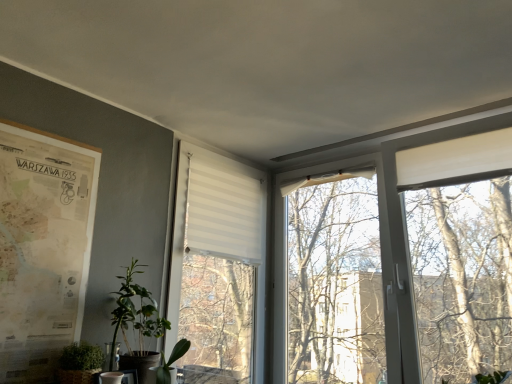
This screenshot has width=512, height=384. I want to click on white striped fabric at center, so click(213, 219).

The width and height of the screenshot is (512, 384). What do you see at coordinates (213, 219) in the screenshot?
I see `white striped fabric at center` at bounding box center [213, 219].

Image resolution: width=512 pixels, height=384 pixels. Describe the element at coordinates (138, 322) in the screenshot. I see `green matte plant at lower left, placed as the 2th houseplant when sorted from right to left` at that location.

Find the location of `green matte plant at lower left, placed as the second houseplant when sorted from left to right`. green matte plant at lower left, placed as the second houseplant when sorted from left to right is located at coordinates (138, 322).

Identify the location of beige paper map at left. Image resolution: width=512 pixels, height=384 pixels. (42, 248).

The height and width of the screenshot is (384, 512). Identify the location of white striped fabric at center. (213, 219).

Does point (170, 338) appear closer or farther from the camera than point (91, 350)?

Point (170, 338) is farther from the camera than point (91, 350).

Based on the photo, could you tell me if white striped fabric at center is facing green matte plant at lower left, the 3th houseplant when ordered from right to left?

No, white striped fabric at center is not facing towards green matte plant at lower left, the 3th houseplant when ordered from right to left.

Which is correct: white striped fabric at center is inside green matte plant at lower left, arranged as the first houseplant when viewed from the left, or outside of it?

white striped fabric at center is located beyond the bounds of green matte plant at lower left, arranged as the first houseplant when viewed from the left.

Where is `the 2nd houseplant below when counting from the white striped fabric at center (from the image's perspective)`? This screenshot has width=512, height=384. the 2nd houseplant below when counting from the white striped fabric at center (from the image's perspective) is located at coordinates (80, 364).

Between beige paper map at left and white striped fabric at center, which one has larger size?

With larger size is white striped fabric at center.

Which of these two, beige paper map at left or white striped fabric at center, is wider?

With larger width is white striped fabric at center.

Is point (60, 277) positioned in front of point (191, 167)?

Yes, it is in front of point (191, 167).

Is beige paper map at left located outside white striped fabric at center?

Indeed, beige paper map at left is completely outside white striped fabric at center.

Looking at this image, which object is further away from the camera, beige paper map at left or green matte plant at lower center, acting as the 3th houseplant starting from the left?

green matte plant at lower center, acting as the 3th houseplant starting from the left, is further from the camera.

Can you confirm if beige paper map at left is positioned to the right of green matte plant at lower center, acting as the 3th houseplant starting from the left?

In fact, beige paper map at left is to the left of green matte plant at lower center, acting as the 3th houseplant starting from the left.

From a real-world perspective, which is physically below, beige paper map at left or green matte plant at lower center, acting as the 3th houseplant starting from the left?

From a 3D spatial view, green matte plant at lower center, acting as the 3th houseplant starting from the left, is below.

Considering the points (4, 250) and (176, 344), which point is behind, point (4, 250) or point (176, 344)?

The point (176, 344) is farther from the camera.

Considering the positions of objects white striped fabric at center and green matte plant at lower center, acting as the 3th houseplant starting from the left, in the image provided, who is behind, white striped fabric at center or green matte plant at lower center, acting as the 3th houseplant starting from the left,?

white striped fabric at center is more distant.

In terms of height, does white striped fabric at center look taller or shorter compared to green matte plant at lower center, which is the first houseplant in right-to-left order?

Considering their sizes, white striped fabric at center has more height than green matte plant at lower center, which is the first houseplant in right-to-left order.

Looking at their sizes, would you say white striped fabric at center is wider or thinner than green matte plant at lower center, acting as the 3th houseplant starting from the left?

In the image, white striped fabric at center appears to be more narrow than green matte plant at lower center, acting as the 3th houseplant starting from the left.

Can you confirm if white striped fabric at center is bigger than green matte plant at lower center, acting as the 3th houseplant starting from the left?

Yes, white striped fabric at center is bigger than green matte plant at lower center, acting as the 3th houseplant starting from the left.

Is green matte plant at lower center, which is the first houseplant in right-to-left order, far from green matte plant at lower left, arranged as the first houseplant when viewed from the left?

green matte plant at lower center, which is the first houseplant in right-to-left order, is actually quite close to green matte plant at lower left, arranged as the first houseplant when viewed from the left.

From the image's perspective, would you say green matte plant at lower center, acting as the 3th houseplant starting from the left, is positioned over green matte plant at lower left, the 3th houseplant when ordered from right to left?

No, from the image's perspective, green matte plant at lower center, acting as the 3th houseplant starting from the left, is not on top of green matte plant at lower left, the 3th houseplant when ordered from right to left.

Considering the sizes of objects green matte plant at lower center, which is the first houseplant in right-to-left order, and green matte plant at lower left, the 3th houseplant when ordered from right to left, in the image provided, who is thinner, green matte plant at lower center, which is the first houseplant in right-to-left order, or green matte plant at lower left, the 3th houseplant when ordered from right to left,?

green matte plant at lower center, which is the first houseplant in right-to-left order.

In terms of height, does green matte plant at lower center, which is the first houseplant in right-to-left order, look taller or shorter compared to green matte plant at lower left, the 3th houseplant when ordered from right to left?

Considering their sizes, green matte plant at lower center, which is the first houseplant in right-to-left order, has less height than green matte plant at lower left, the 3th houseplant when ordered from right to left.

Considering the sizes of green matte plant at lower left, placed as the 2th houseplant when sorted from right to left, and green matte plant at lower left, the 3th houseplant when ordered from right to left, in the image, is green matte plant at lower left, placed as the 2th houseplant when sorted from right to left, bigger or smaller than green matte plant at lower left, the 3th houseplant when ordered from right to left,?

Considering their sizes, green matte plant at lower left, placed as the 2th houseplant when sorted from right to left, takes up more space than green matte plant at lower left, the 3th houseplant when ordered from right to left.

From a real-world perspective, is green matte plant at lower left, placed as the 2th houseplant when sorted from right to left, located beneath green matte plant at lower left, the 3th houseplant when ordered from right to left?

No.

Is point (129, 303) farther from camera compared to point (84, 367)?

Yes, it is behind point (84, 367).

From a real-world perspective, is green matte plant at lower left, the 3th houseplant when ordered from right to left, physically above white striped fabric at center?

Actually, green matte plant at lower left, the 3th houseplant when ordered from right to left, is physically below white striped fabric at center in the real world.

Does green matte plant at lower left, the 3th houseplant when ordered from right to left, appear on the left side of white striped fabric at center?

Yes, green matte plant at lower left, the 3th houseplant when ordered from right to left, is to the left of white striped fabric at center.

Which object is closer to the camera taking this photo, green matte plant at lower left, arranged as the first houseplant when viewed from the left, or white striped fabric at center?

Positioned in front is green matte plant at lower left, arranged as the first houseplant when viewed from the left.

Locate an element on the screen. window screen that is on the right side of green matte plant at lower left, arranged as the first houseplant when viewed from the left is located at coordinates (213, 219).

The height and width of the screenshot is (384, 512). I want to click on window screen behind the beige paper map at left, so click(213, 219).

Which object lies further to the anchor point white striped fabric at center, beige paper map at left or green matte plant at lower left, placed as the second houseplant when sorted from left to right?

beige paper map at left is positioned further to the anchor white striped fabric at center.

When comparing their distances from green matte plant at lower left, placed as the 2th houseplant when sorted from right to left, does green matte plant at lower left, the 3th houseplant when ordered from right to left, or green matte plant at lower center, acting as the 3th houseplant starting from the left, seem further?

green matte plant at lower left, the 3th houseplant when ordered from right to left.

When comparing their distances from green matte plant at lower left, arranged as the first houseplant when viewed from the left, does beige paper map at left or white striped fabric at center seem further?

white striped fabric at center is positioned further to the anchor green matte plant at lower left, arranged as the first houseplant when viewed from the left.

Estimate the real-world distances between objects in this image. Which object is further from beige paper map at left, green matte plant at lower left, arranged as the first houseplant when viewed from the left, or green matte plant at lower center, acting as the 3th houseplant starting from the left?

green matte plant at lower center, acting as the 3th houseplant starting from the left.

Looking at the image, which one is located further to green matte plant at lower left, placed as the second houseplant when sorted from left to right, white striped fabric at center or green matte plant at lower left, the 3th houseplant when ordered from right to left?

The object further to green matte plant at lower left, placed as the second houseplant when sorted from left to right, is white striped fabric at center.

Looking at the image, which one is located further to green matte plant at lower left, the 3th houseplant when ordered from right to left, beige paper map at left or green matte plant at lower left, placed as the 2th houseplant when sorted from right to left?

beige paper map at left.

When comparing their distances from green matte plant at lower left, placed as the 2th houseplant when sorted from right to left, does green matte plant at lower center, acting as the 3th houseplant starting from the left, or beige paper map at left seem closer?

Based on the image, green matte plant at lower center, acting as the 3th houseplant starting from the left, appears to be nearer to green matte plant at lower left, placed as the 2th houseplant when sorted from right to left.

Looking at the image, which one is located closer to white striped fabric at center, beige paper map at left or green matte plant at lower left, arranged as the first houseplant when viewed from the left?

beige paper map at left lies closer to white striped fabric at center than the other object.

At what (x,y) coordinates should I click in order to perform the action: click on houseplant between beige paper map at left and green matte plant at lower left, the 3th houseplant when ordered from right to left, in the up-down direction. Please return your answer as a coordinate pair (x, y). Looking at the image, I should click on (138, 322).

This screenshot has width=512, height=384. I want to click on houseplant between green matte plant at lower left, arranged as the first houseplant when viewed from the left, and green matte plant at lower center, acting as the 3th houseplant starting from the left, in the horizontal direction, so click(138, 322).

Identify the location of houseplant between green matte plant at lower center, which is the first houseplant in right-to-left order, and white striped fabric at center in the front-back direction. (138, 322).